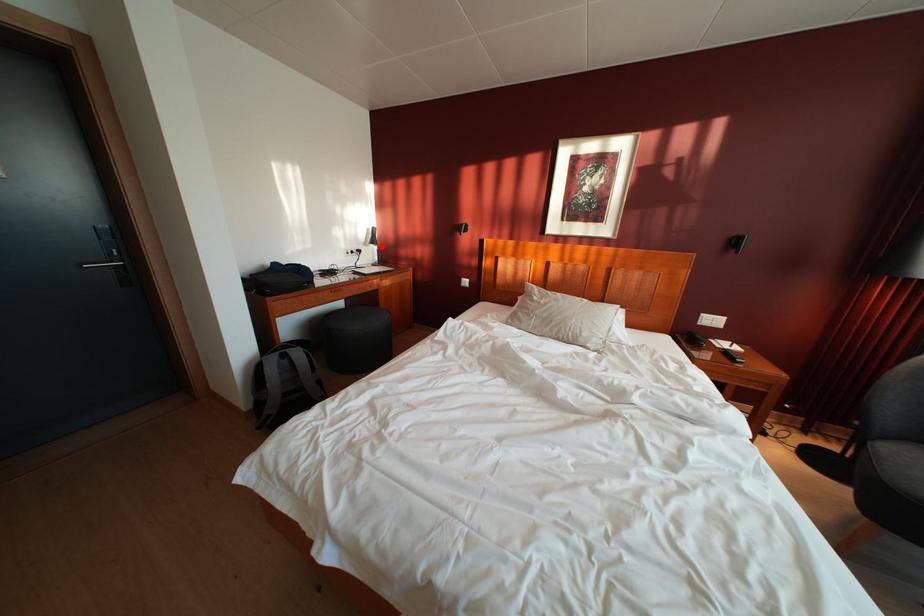
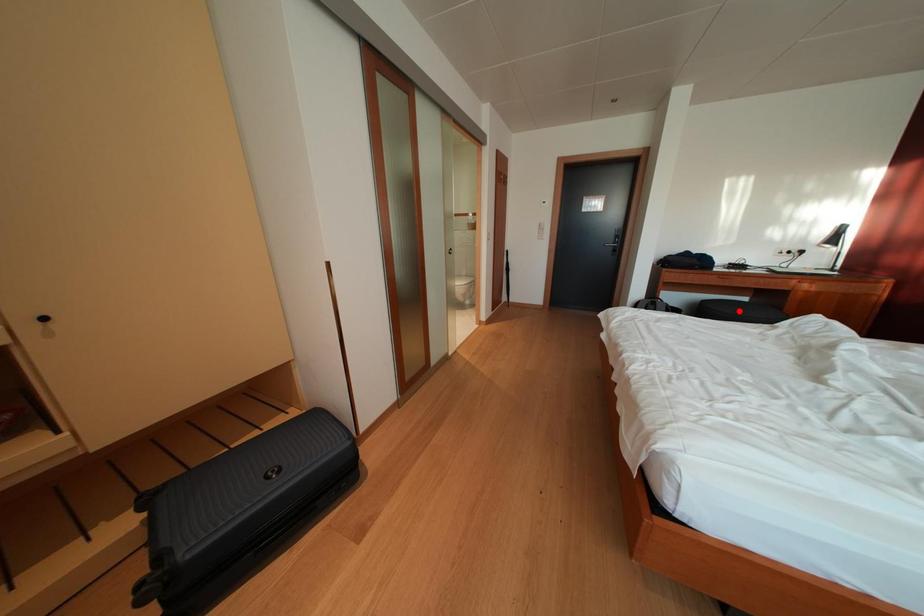
I am providing you with two images of the same scene from different viewpoints. A red point is marked on the first image and another point is marked on the second image. Do the highlighted points in image1 and image2 indicate the same real-world spot?

No